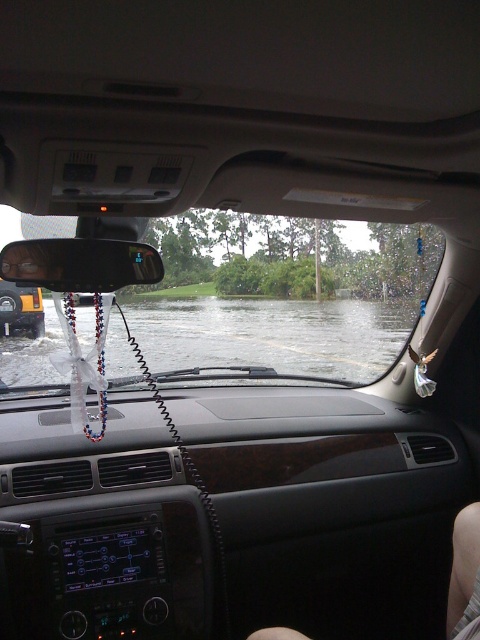
Question: Among these objects, which one is nearest to the camera?

Choices:
 (A) clear water at center
 (B) metallic yellow truck at center

Answer: (A)

Question: Is transparent glass windshield at center to the left of clear water at center from the viewer's perspective?

Choices:
 (A) no
 (B) yes

Answer: (B)

Question: Is transparent glass windshield at center above metallic yellow truck at center?

Choices:
 (A) yes
 (B) no

Answer: (A)

Question: Which object is the farthest from the transparent glass windshield at center?

Choices:
 (A) metallic yellow truck at center
 (B) clear water at center

Answer: (A)

Question: Which is farther from the transparent glass windshield at center?

Choices:
 (A) metallic yellow truck at center
 (B) clear water at center

Answer: (A)

Question: Can you confirm if clear water at center is positioned to the left of metallic yellow truck at center?

Choices:
 (A) yes
 (B) no

Answer: (B)